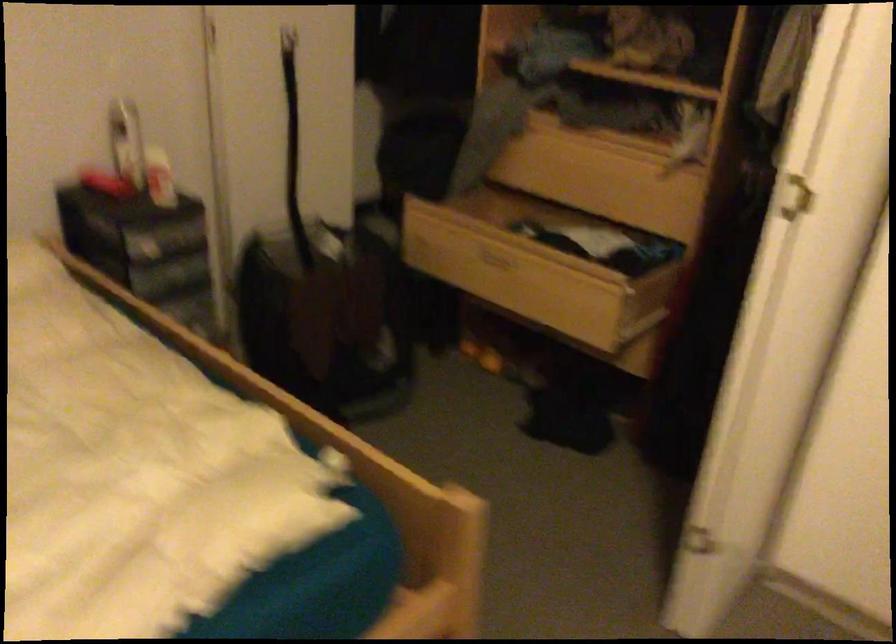
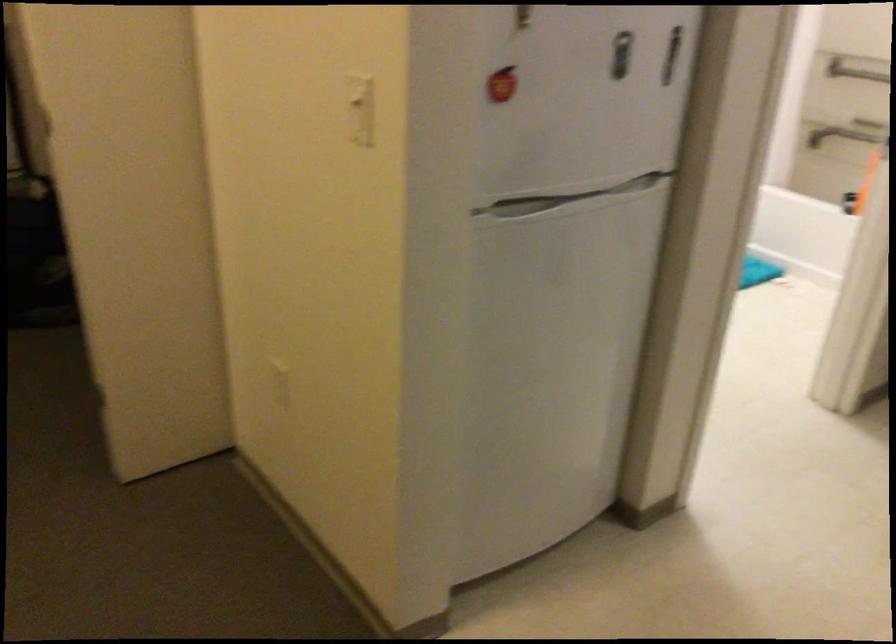
Question: I am providing you with two images of the same scene from different viewpoints. Please identify which objects are invisible in image2.

Choices:
 (A) open wooden drawer
 (B) white door frame
 (C) metal grab bar
 (D) refrigerator handle

Answer: (A)